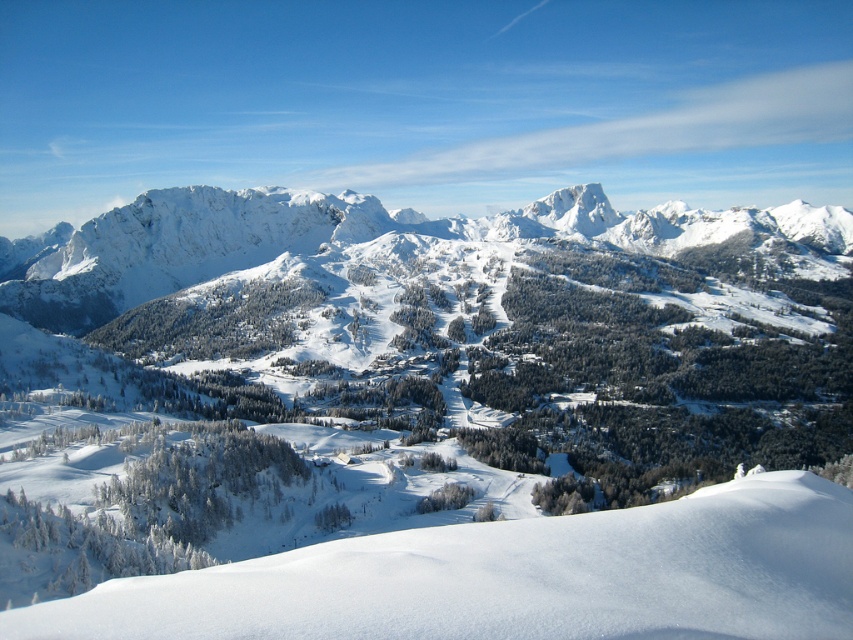
Does white snow ski slope at lower left have a lesser height compared to white snow-covered mountain range at center?

Indeed, white snow ski slope at lower left has a lesser height compared to white snow-covered mountain range at center.

Does white snow ski slope at lower left have a smaller size compared to white snow-covered mountain range at center?

Indeed, white snow ski slope at lower left has a smaller size compared to white snow-covered mountain range at center.

Locate an element on the screen. white snow ski slope at lower left is located at coordinates (517, 577).